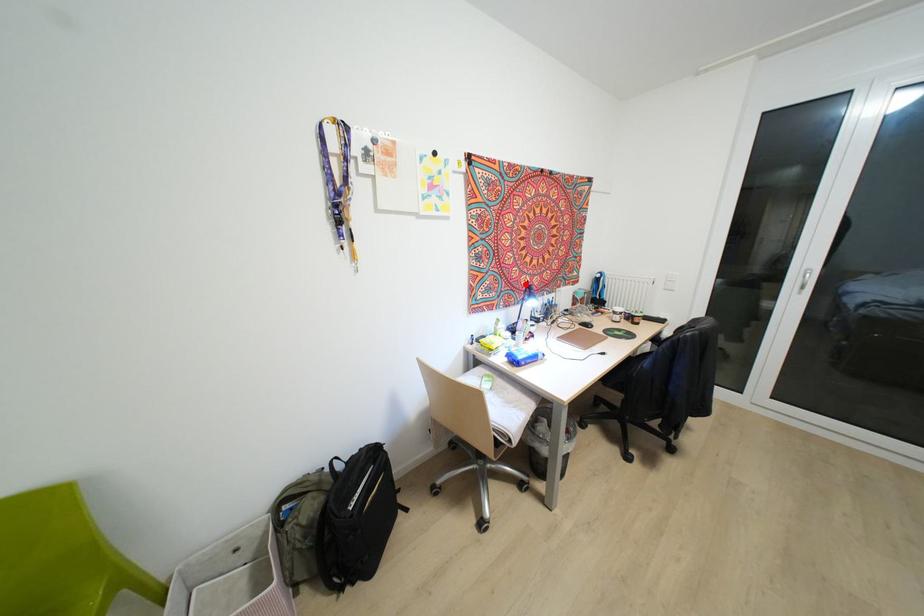
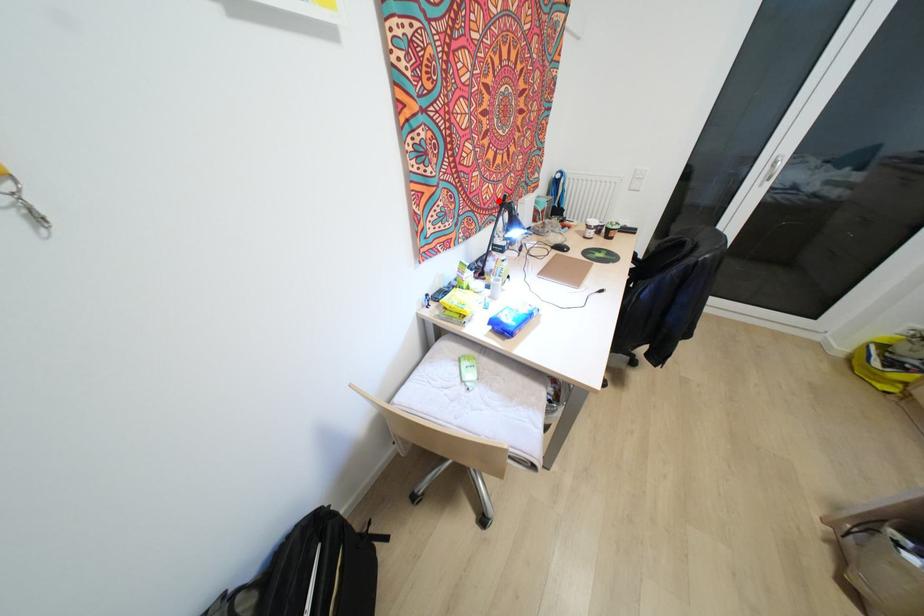
I am providing you with two images of the same scene from different viewpoints. A red point is marked on the first image and another point is marked on the second image. Is the red point in image1 aligned with the point shown in image2?

Yes